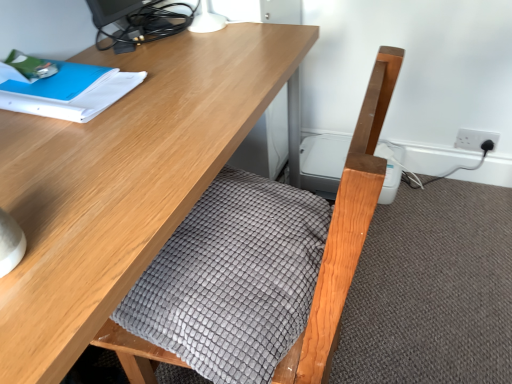
Question: Considering the relative sizes of blue paper at upper left and matte black monitor at upper left in the image provided, is blue paper at upper left shorter than matte black monitor at upper left?

Choices:
 (A) no
 (B) yes

Answer: (B)

Question: From the image's perspective, would you say blue paper at upper left is shown under matte black monitor at upper left?

Choices:
 (A) yes
 (B) no

Answer: (A)

Question: Can you confirm if blue paper at upper left is smaller than matte black monitor at upper left?

Choices:
 (A) yes
 (B) no

Answer: (A)

Question: Is blue paper at upper left looking in the opposite direction of matte black monitor at upper left?

Choices:
 (A) no
 (B) yes

Answer: (A)

Question: From a real-world perspective, is blue paper at upper left under matte black monitor at upper left?

Choices:
 (A) yes
 (B) no

Answer: (A)

Question: Relative to gray textured blanket at center, is matte black monitor at upper left in front or behind?

Choices:
 (A) front
 (B) behind

Answer: (B)

Question: Looking at their shapes, would you say matte black monitor at upper left is wider or thinner than gray textured blanket at center?

Choices:
 (A) wide
 (B) thin

Answer: (B)

Question: In terms of height, does matte black monitor at upper left look taller or shorter compared to gray textured blanket at center?

Choices:
 (A) short
 (B) tall

Answer: (B)

Question: In the image, is matte black monitor at upper left on the left side or the right side of gray textured blanket at center?

Choices:
 (A) left
 (B) right

Answer: (A)

Question: Is point (96, 130) closer or farther from the camera than point (462, 130)?

Choices:
 (A) farther
 (B) closer

Answer: (B)

Question: Based on their positions, is wooden desk at center located to the left or right of white plastic socket at upper right?

Choices:
 (A) left
 (B) right

Answer: (A)

Question: From the image's perspective, is wooden desk at center above or below white plastic socket at upper right?

Choices:
 (A) below
 (B) above

Answer: (A)

Question: Considering the positions of wooden desk at center and white plastic socket at upper right in the image, is wooden desk at center taller or shorter than white plastic socket at upper right?

Choices:
 (A) short
 (B) tall

Answer: (B)

Question: Does point (59, 195) appear closer or farther from the camera than point (74, 64)?

Choices:
 (A) farther
 (B) closer

Answer: (B)

Question: From the image's perspective, is wooden desk at center above or below blue paper at upper left?

Choices:
 (A) above
 (B) below

Answer: (B)